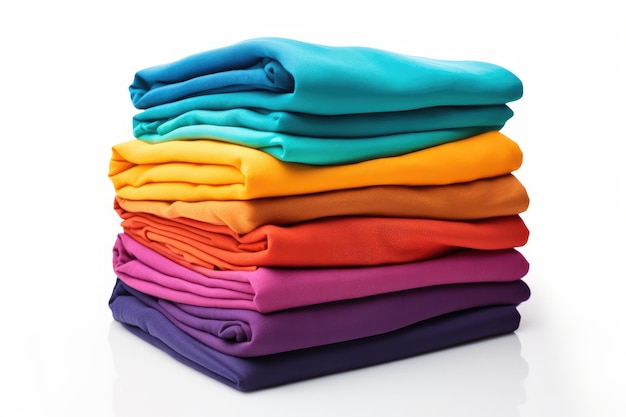
Find the location of a particular element. The width and height of the screenshot is (626, 417). folded stack of fabric pieces is located at coordinates (325, 83), (305, 124), (305, 156), (300, 185), (310, 204), (317, 249), (310, 294), (319, 342), (300, 366).